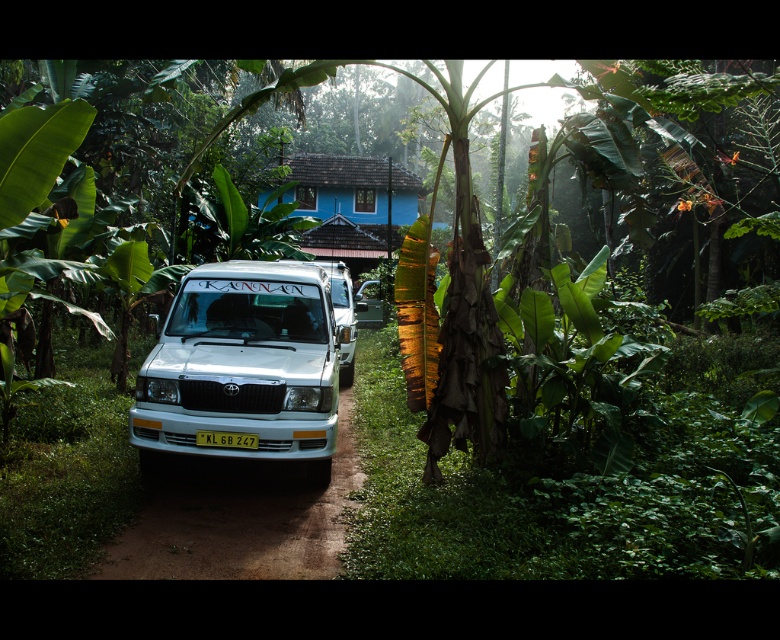
Which of these two, white matte van at center or blue painted wooden hut at center, stands shorter?

Standing shorter between the two is white matte van at center.

Find the location of `white matte van at center`. white matte van at center is located at coordinates tap(243, 365).

Find the location of a particular element. The image size is (780, 640). white matte van at center is located at coordinates (243, 365).

Is white matte van at center shorter than yellow plastic license plate at center?

Incorrect, white matte van at center's height does not fall short of yellow plastic license plate at center's.

Does point (332, 348) come closer to viewer compared to point (236, 442)?

That is False.

Identify the location of white matte van at center. point(243,365).

Who is shorter, brown dirt track at center or blue painted wooden hut at center?

Standing shorter between the two is brown dirt track at center.

Does brown dirt track at center come behind blue painted wooden hut at center?

No, it is in front of blue painted wooden hut at center.

Between point (273, 531) and point (324, 184), which one is positioned in front?

Point (273, 531)

I want to click on brown dirt track at center, so click(x=238, y=518).